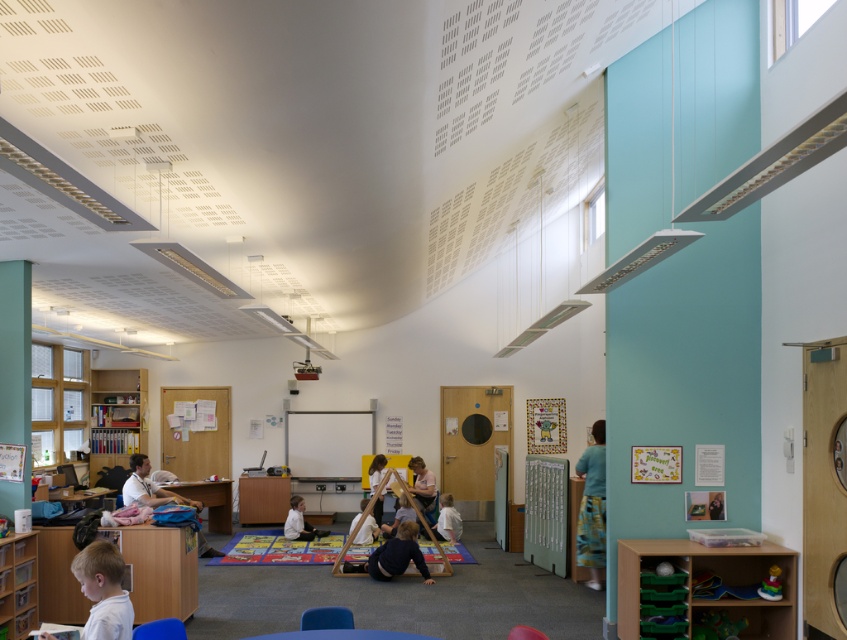
Question: Which object appears closest to the camera in this image?

Choices:
 (A) matte blue chair at lower center
 (B) wooden bookshelf at left

Answer: (A)

Question: Which object is positioned farthest from the wooden bookshelf at left?

Choices:
 (A) matte white shirt at left
 (B) translucent plastic bookshelf at lower left

Answer: (B)

Question: Does translucent plastic bookshelf at lower left have a greater width compared to matte blue chair at lower center?

Choices:
 (A) no
 (B) yes

Answer: (A)

Question: Is wooden bookshelf at left to the left of matte blue chair at lower center from the viewer's perspective?

Choices:
 (A) no
 (B) yes

Answer: (B)

Question: Which of the following is the farthest from the observer?

Choices:
 (A) rubberized plastic toy at lower right
 (B) light brown wooden chair at center

Answer: (B)

Question: Is wooden bookshelf at left below rubberized plastic toy at lower right?

Choices:
 (A) no
 (B) yes

Answer: (A)